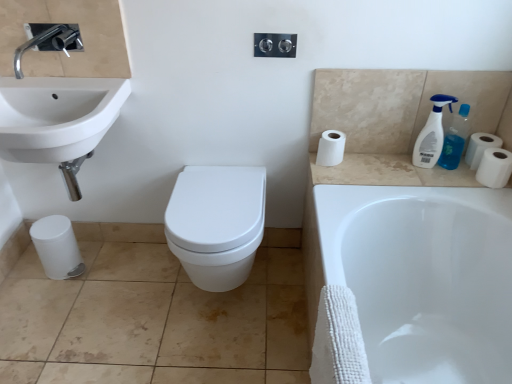
Locate an element on the screen. vacant space underneath black metallic faucet at upper left (from a real-world perspective) is located at coordinates (57, 84).